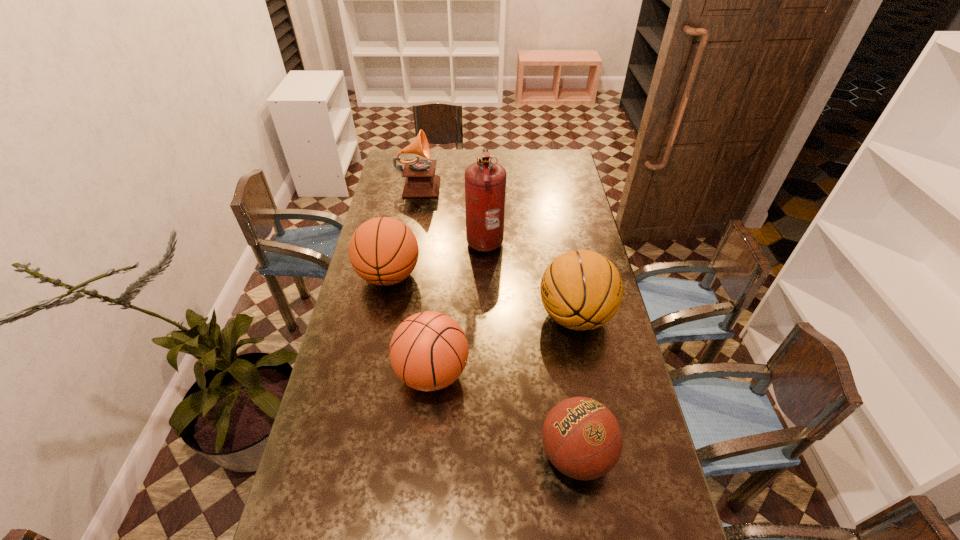
I want to click on fire extinguisher, so click(x=485, y=182).

In order to click on the farthest object in this screenshot , I will do click(x=421, y=182).

Locate an element on the screen. The width and height of the screenshot is (960, 540). the shortest basketball is located at coordinates (582, 438).

Where is `the shortest object`? the shortest object is located at coordinates (582, 438).

Find the location of a particular element. The width and height of the screenshot is (960, 540). free space located at the front of the fire extinguisher where the nozzle is aimed is located at coordinates (398, 239).

I want to click on vacant region located 0.300m at the front of the fire extinguisher where the nozzle is aimed, so click(x=394, y=239).

The width and height of the screenshot is (960, 540). I want to click on free spot located 0.280m at the front of the fire extinguisher where the nozzle is aimed, so click(398, 239).

At what (x,y) coordinates should I click in order to perform the action: click on blank space located 0.350m on the horn of the phonograph record. Please return your answer as a coordinate pair (x, y). Looking at the image, I should click on (514, 184).

This screenshot has width=960, height=540. What are the coordinates of `free space located on the left of the nearest basketball` in the screenshot? It's located at (434, 454).

Find the location of a particular element. This screenshot has width=960, height=540. object located in the far edge section of the desktop is located at coordinates (421, 182).